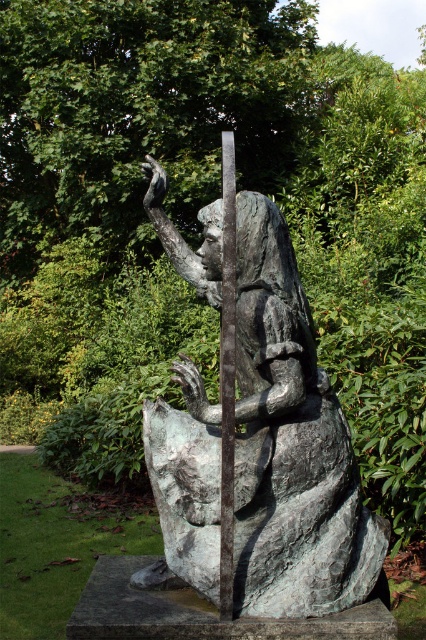
Question: Is bronze statue at center closer to the viewer compared to smooth gray pole at center?

Choices:
 (A) no
 (B) yes

Answer: (A)

Question: Which of the following is the farthest from the observer?

Choices:
 (A) (299, 365)
 (B) (229, 326)

Answer: (A)

Question: Is bronze statue at center thinner than smooth gray pole at center?

Choices:
 (A) no
 (B) yes

Answer: (A)

Question: Does bronze statue at center have a greater width compared to smooth gray pole at center?

Choices:
 (A) no
 (B) yes

Answer: (B)

Question: Which of the following is the farthest from the observer?

Choices:
 (A) (285, 500)
 (B) (224, 368)

Answer: (A)